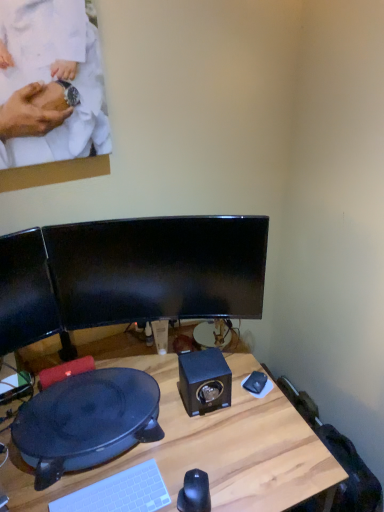
The width and height of the screenshot is (384, 512). Identify the location of vacant area that is situated to the right of black glossy mouse at lower center. (248, 490).